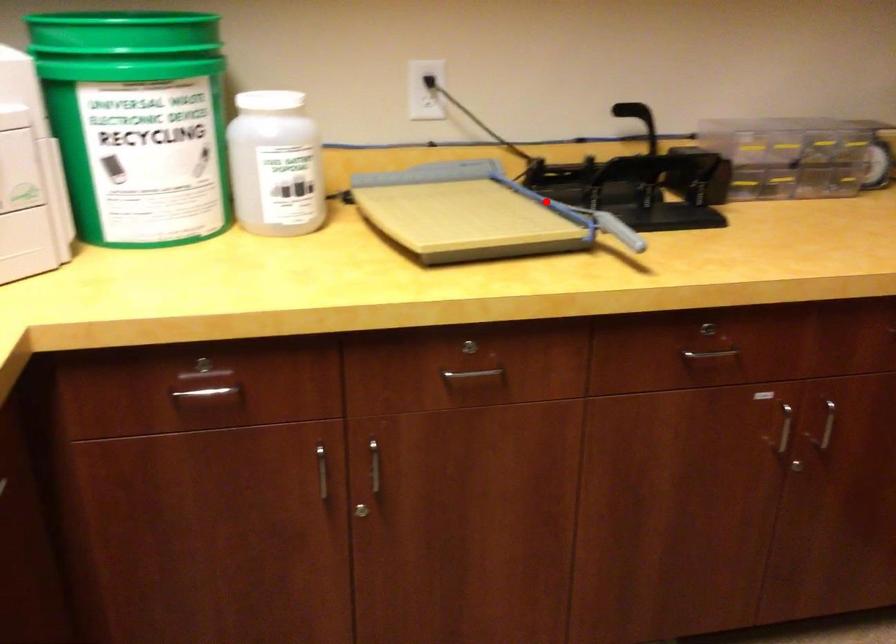
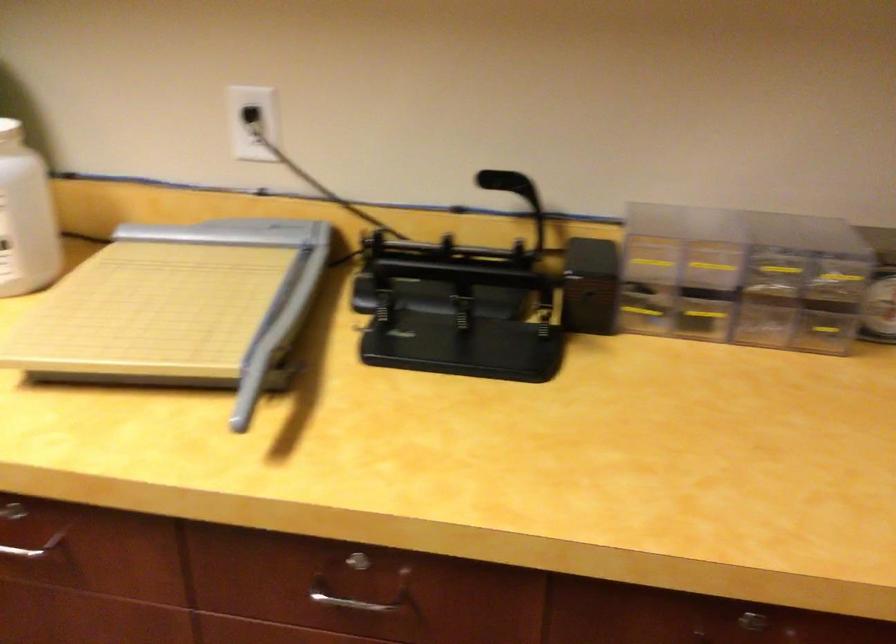
Question: I am providing you with two images of the same scene from different viewpoints. Given a red point in image1, look at the same physical point in image2. Is it:

Choices:
 (A) Closer to the viewpoint
 (B) Farther from the viewpoint

Answer: (A)